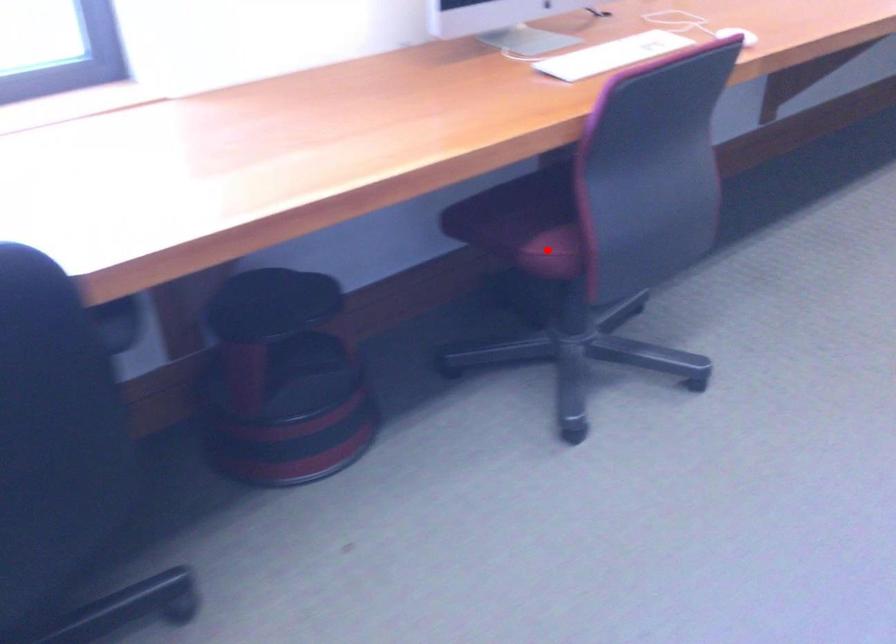
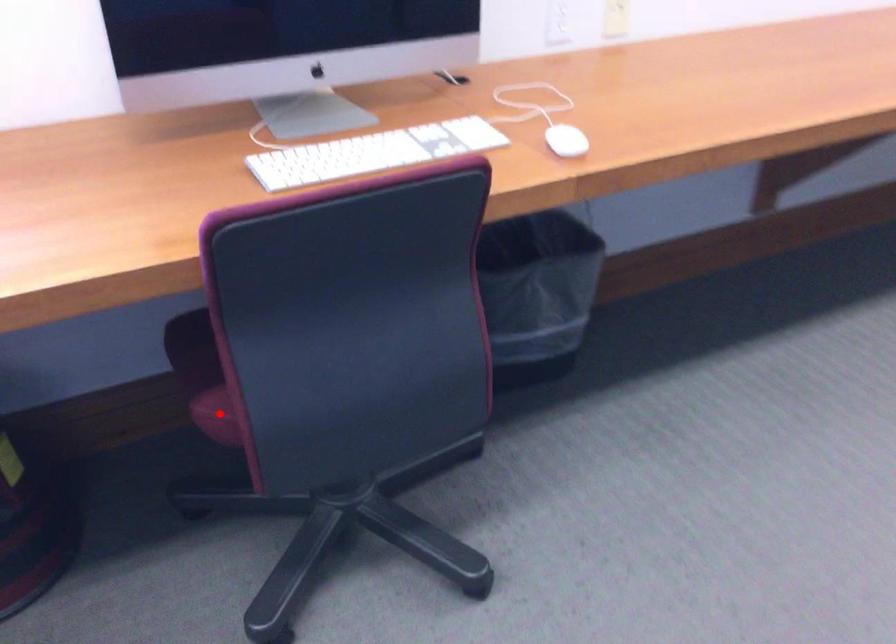
I am providing you with two images of the same scene from different viewpoints. A red point is marked on the first image and another point is marked on the second image. Is the marked point in image1 the same physical position as the marked point in image2?

Yes